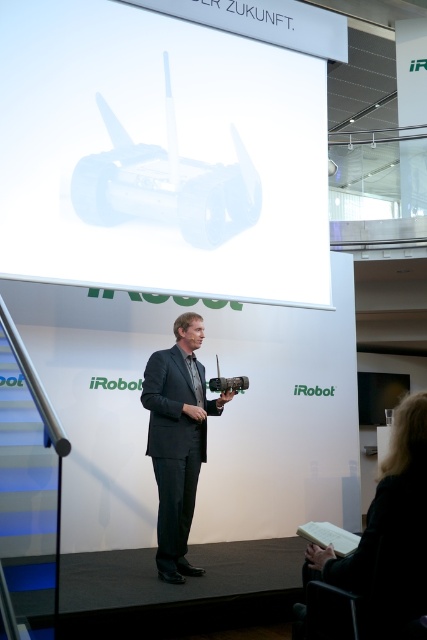
Question: Which object appears closest to the camera in this image?

Choices:
 (A) dark gray suit at center
 (B) white glossy projector at upper center

Answer: (A)

Question: Can you confirm if white glossy projector at upper center is positioned below dark gray suit at center?

Choices:
 (A) no
 (B) yes

Answer: (A)

Question: Which point is closer to the camera?

Choices:
 (A) (134, 35)
 (B) (219, 400)

Answer: (B)

Question: Does white glossy projector at upper center lie behind dark gray suit at center?

Choices:
 (A) yes
 (B) no

Answer: (A)

Question: Does white glossy projector at upper center appear on the left side of dark gray suit at center?

Choices:
 (A) no
 (B) yes

Answer: (B)